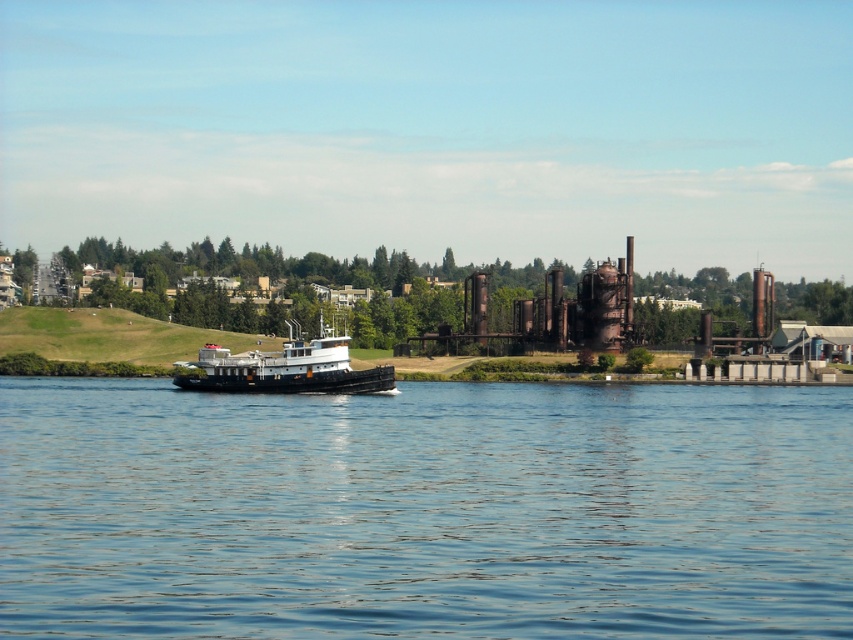
Which is behind, point (189, 561) or point (299, 336)?

Point (299, 336)

Who is taller, blue water at center or black matte tugboat at center?

With more height is black matte tugboat at center.

Who is more distant from viewer, (183, 435) or (355, 376)?

Point (355, 376)

Locate an element on the screen. blue water at center is located at coordinates (424, 509).